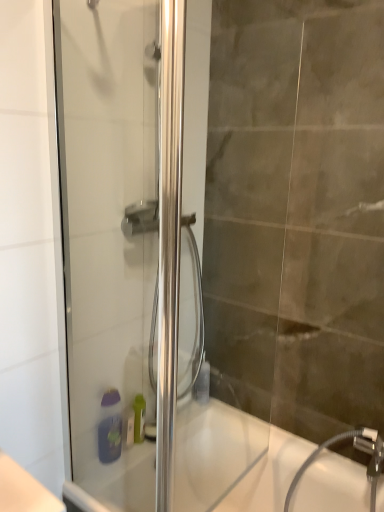
Question: From the image's perspective, is translucent plastic bottle at lower center on top of purple matte soap dispenser at lower center?

Choices:
 (A) no
 (B) yes

Answer: (B)

Question: Could you tell me if translucent plastic bottle at lower center is facing purple matte soap dispenser at lower center?

Choices:
 (A) no
 (B) yes

Answer: (A)

Question: Is purple matte soap dispenser at lower center at the back of translucent plastic bottle at lower center?

Choices:
 (A) yes
 (B) no

Answer: (B)

Question: Can you confirm if translucent plastic bottle at lower center is bigger than purple matte soap dispenser at lower center?

Choices:
 (A) yes
 (B) no

Answer: (B)

Question: From the image's perspective, is translucent plastic bottle at lower center below purple matte soap dispenser at lower center?

Choices:
 (A) no
 (B) yes

Answer: (A)

Question: Can you confirm if translucent plastic bottle at lower center is taller than purple matte soap dispenser at lower center?

Choices:
 (A) yes
 (B) no

Answer: (B)

Question: Is translucent plastic bottle at lower center located outside white glossy bathtub at lower center?

Choices:
 (A) yes
 (B) no

Answer: (A)

Question: Considering the relative positions of translucent plastic bottle at lower center and white glossy bathtub at lower center in the image provided, is translucent plastic bottle at lower center to the left of white glossy bathtub at lower center from the viewer's perspective?

Choices:
 (A) yes
 (B) no

Answer: (A)

Question: From a real-world perspective, is translucent plastic bottle at lower center located higher than white glossy bathtub at lower center?

Choices:
 (A) yes
 (B) no

Answer: (A)

Question: Is translucent plastic bottle at lower center shorter than white glossy bathtub at lower center?

Choices:
 (A) no
 (B) yes

Answer: (B)

Question: From the image's perspective, is translucent plastic bottle at lower center located above white glossy bathtub at lower center?

Choices:
 (A) yes
 (B) no

Answer: (A)

Question: Is translucent plastic bottle at lower center aimed at white glossy bathtub at lower center?

Choices:
 (A) no
 (B) yes

Answer: (A)

Question: Is purple matte soap dispenser at lower center positioned with its back to white glossy bathtub at lower center?

Choices:
 (A) yes
 (B) no

Answer: (B)